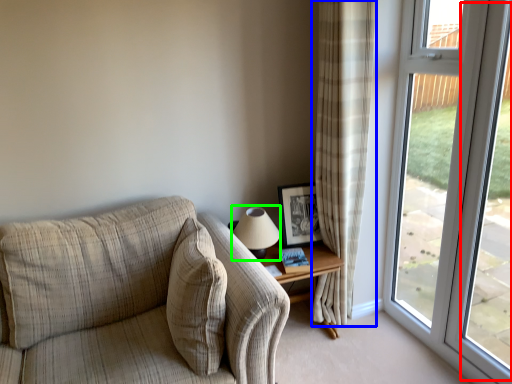
Question: Considering the real-world distances, which object is farthest from window screen (highlighted by a red box)? curtain (highlighted by a blue box) or table lamp (highlighted by a green box)?

Choices:
 (A) curtain
 (B) table lamp

Answer: (B)